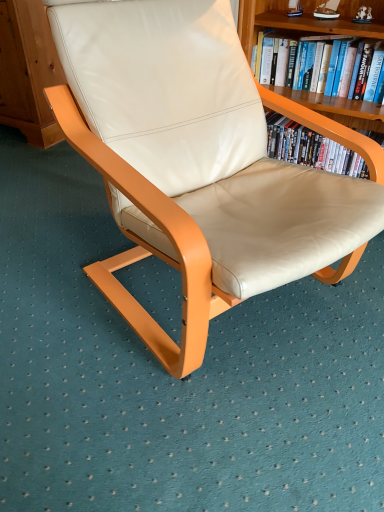
Locate an element on the screen. free spot in front of beige leather chair at center is located at coordinates (201, 426).